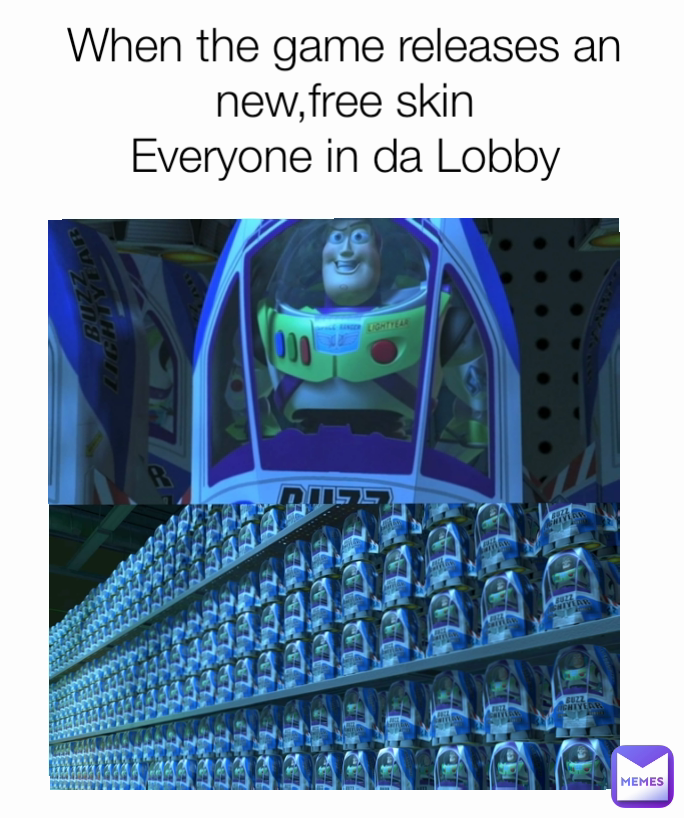
Where is `back of shelf`? back of shelf is located at coordinates (527, 306).